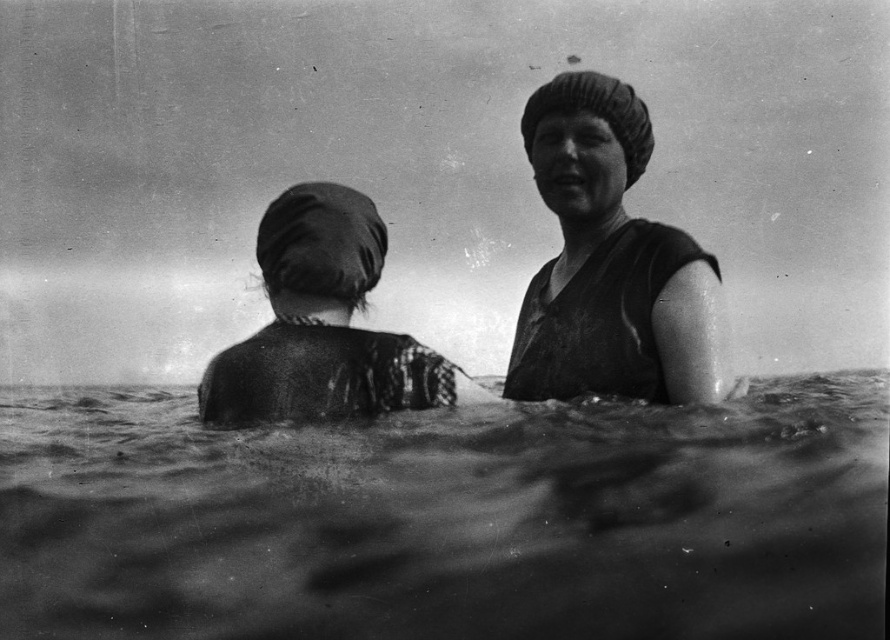
Looking at this image, you are a photographer analyzing this black and white image. You notice the rough textured water at center and the smooth fabric swim cap at upper right. Based on their positions, which object is located more to the left?

The rough textured water at center is positioned on the left side of smooth fabric swim cap at upper right, so it is more to the left.

You are a photographer analyzing this black and white image. You notice the rough textured water at center and the dark fabric headscarf at left. Which object appears nearer to you in the scene?

The rough textured water at center is closer to the viewer than the dark fabric headscarf at left, so the rough textured water at center appears nearer in the scene.

You are a photographer trying to capture a closeup shot of both the smooth fabric swim cap at upper right and the dark fabric headscarf at left in this historical image. Given the distance between them, will your camera lens with a 2.5 feet minimum focusing distance be sufficient to capture both clearly?

The distance between the smooth fabric swim cap at upper right and the dark fabric headscarf at left is 3.54 feet, which exceeds the camera lens minimum focusing distance of 2.5 feet. Therefore, the lens may not be able to focus on both objects simultaneously, resulting in one being blurry.